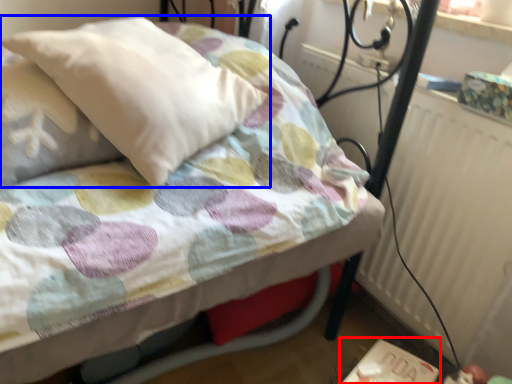
Question: Which object appears closest to the camera in this image, table (highlighted by a red box) or pillow (highlighted by a blue box)?

Choices:
 (A) table
 (B) pillow

Answer: (B)